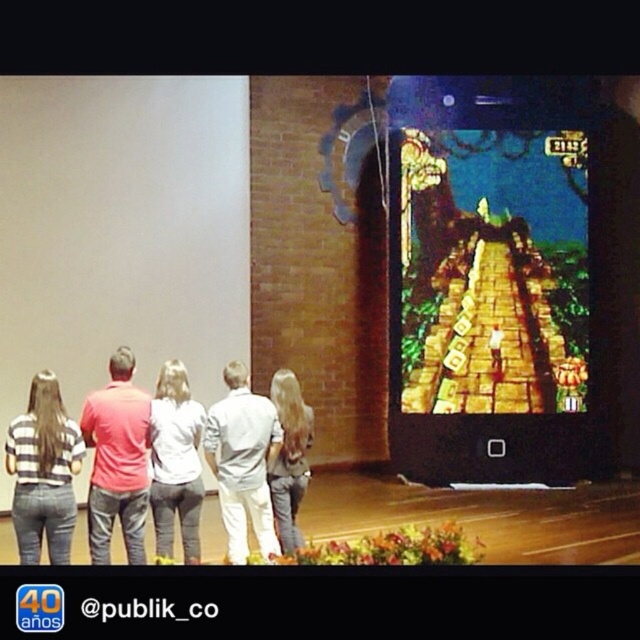
Is red shirt at left to the left of striped shirt at left from the viewer's perspective?

Incorrect, red shirt at left is not on the left side of striped shirt at left.

Is point (116, 360) positioned in front of point (76, 445)?

No, it is not.

Between point (99, 515) and point (61, 540), which one is positioned in front?

Point (61, 540)

Image resolution: width=640 pixels, height=640 pixels. Identify the location of red shirt at left. (116, 460).

Between point (237, 461) and point (307, 467), which one is positioned behind?

The point (307, 467) is behind.

Is white cotton shirt at center bigger than denim jeans at center?

Yes.

I want to click on white cotton shirt at center, so click(243, 461).

Does golden stone staircase at center have a greater width compared to striped shirt at left?

Indeed, golden stone staircase at center has a greater width compared to striped shirt at left.

How much distance is there between golden stone staircase at center and striped shirt at left?

golden stone staircase at center is 5.22 meters away from striped shirt at left.

Is point (532, 371) behind point (44, 428)?

Yes, it is behind point (44, 428).

What are the coordinates of `golden stone staircase at center` in the screenshot? It's located at (492, 272).